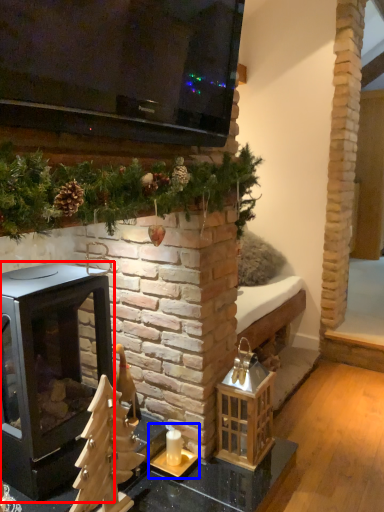
Question: Which object is further to the camera taking this photo, wood burning stove (highlighted by a red box) or candle holder (highlighted by a blue box)?

Choices:
 (A) wood burning stove
 (B) candle holder

Answer: (B)